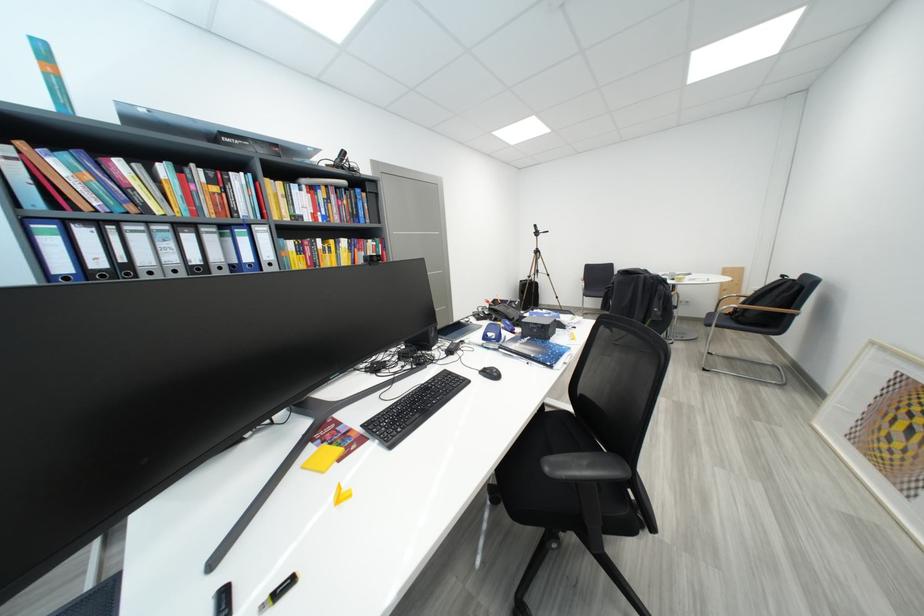
The height and width of the screenshot is (616, 924). Describe the element at coordinates (638, 275) in the screenshot. I see `a backpack top handle` at that location.